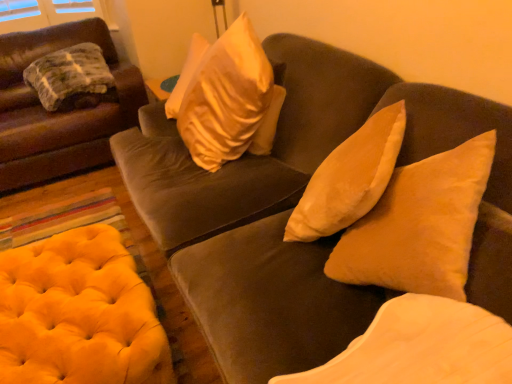
Question: Is suede beige pillow at center, which is the 2th pillow in top-to-bottom order, to the left or to the right of velvet beige pillow at center, the second pillow viewed from the left, in the image?

Choices:
 (A) left
 (B) right

Answer: (B)

Question: Considering the positions of point (453, 266) and point (439, 360), is point (453, 266) closer or farther from the camera than point (439, 360)?

Choices:
 (A) closer
 (B) farther

Answer: (B)

Question: Which of these objects is positioned farthest from the velvet beige pillow at center, the 2th pillow viewed from the right?

Choices:
 (A) suede beige pillow at center, which is the 2th pillow in top-to-bottom order
 (B) yellow tufted ottoman at lower left
 (C) velvet brown couch at center, the 2th studio couch when ordered from left to right
 (D) velvet brown couch at left, placed as the 2th studio couch when sorted from right to left
 (E) green textured blanket at left, which is the third pillow in front-to-back order

Answer: (E)

Question: Considering the real-world distances, which object is closest to the suede beige pillow at center, which is the second pillow from front to back?

Choices:
 (A) green textured blanket at left, which is the third pillow in front-to-back order
 (B) velvet beige pillow at center, positioned as the 1th pillow in bottom-to-top order
 (C) yellow tufted ottoman at lower left
 (D) velvet brown couch at left, the first studio couch in the left-to-right sequence
 (E) velvet brown couch at center, the 2th studio couch when ordered from left to right

Answer: (B)